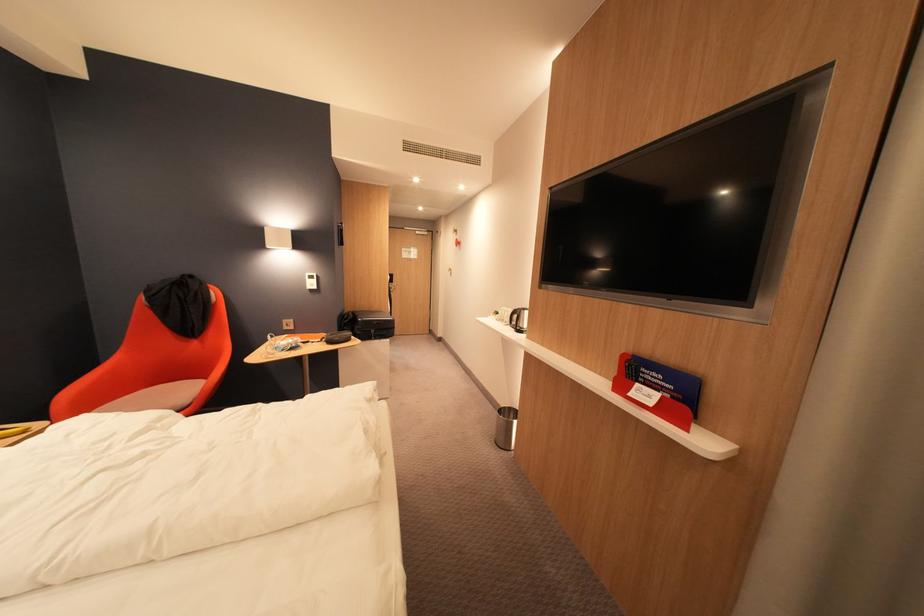
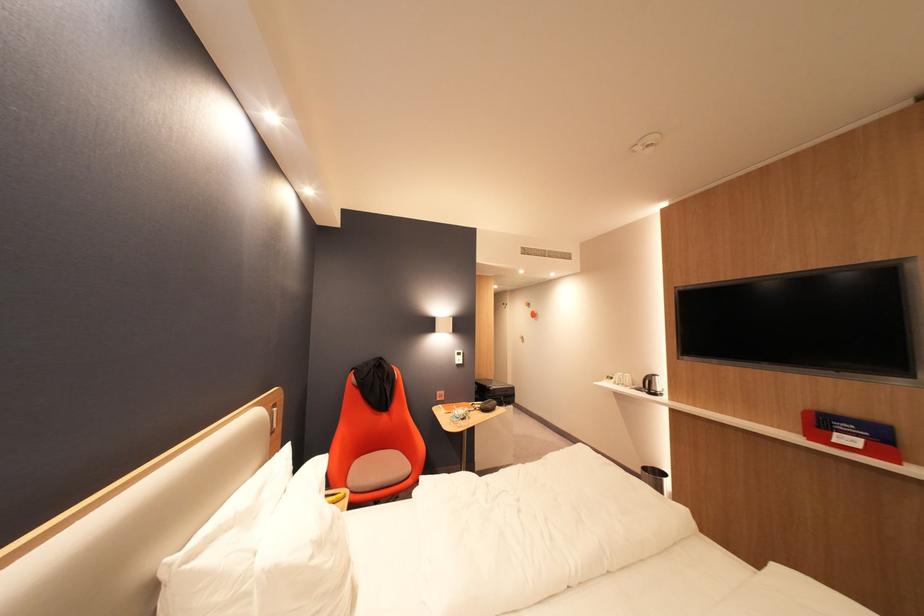
In the second image, find the point that corresponds to point (370, 321) in the first image.

(502, 390)